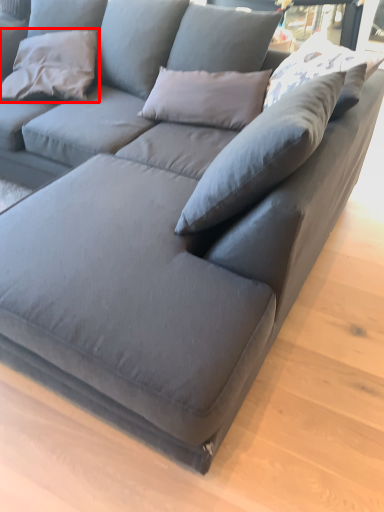
Question: From the image's perspective, what is the correct spatial relationship of pillow (annotated by the red box) in relation to pillow?

Choices:
 (A) below
 (B) above

Answer: (B)